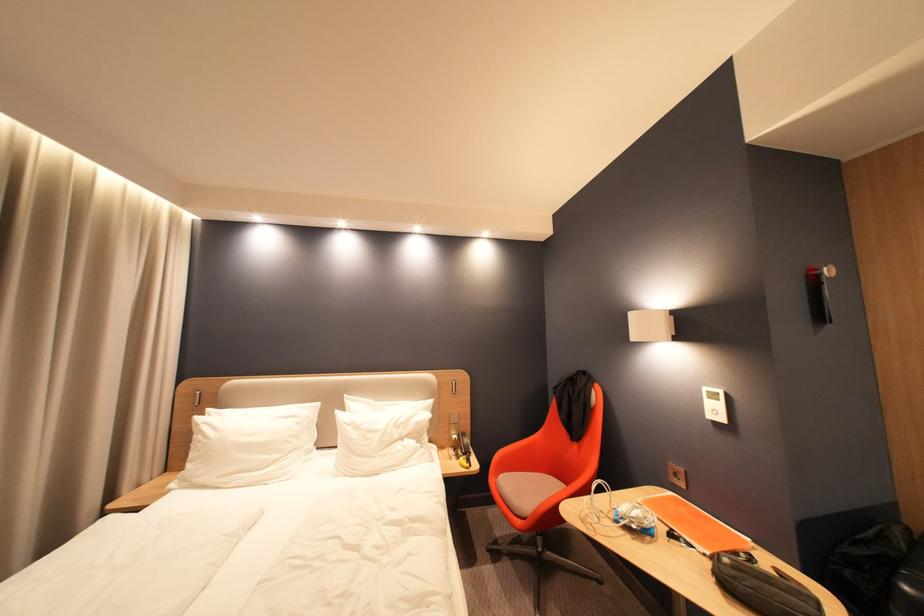
Locate an element on the screen. orange chair armrest is located at coordinates click(x=516, y=451).